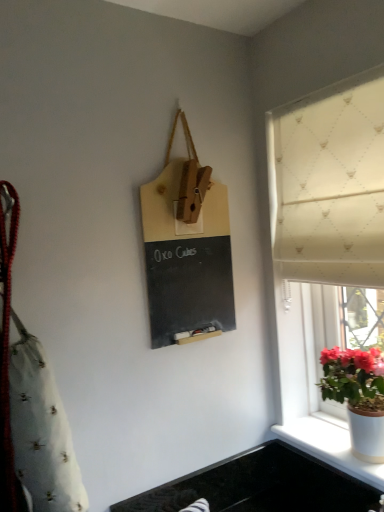
The image size is (384, 512). What are the coordinates of `white glossy pot at window` in the screenshot? It's located at (358, 396).

Measure the distance between point (184, 225) and camera.

The distance of point (184, 225) from camera is 1.20 meters.

The height and width of the screenshot is (512, 384). In order to click on white textured fabric at right in this screenshot , I will do `click(331, 254)`.

Is white textured fabric at right with white glossy pot at window?

No, white textured fabric at right is not with white glossy pot at window.

Which is further, (369, 143) or (364, 383)?

Positioned behind is point (364, 383).

Do you think white textured fabric at right is within white glossy pot at window, or outside of it?

white textured fabric at right lies outside white glossy pot at window.

From the image's perspective, relative to white ceramic pot at lower right, is white glossy pot at window above or below?

white glossy pot at window is situated higher than white ceramic pot at lower right in the image.

From a real-world perspective, is white glossy pot at window over white ceramic pot at lower right?

Yes.

Is white glossy pot at window inside the boundaries of white ceramic pot at lower right, or outside?

The correct answer is: outside.

Locate an element on the screen. window sill below the white glossy pot at window (from the image's perspective) is located at coordinates (329, 445).

Choose the correct answer: Is white ceramic pot at lower right inside black granite sink at lower center or outside it?

white ceramic pot at lower right is located beyond the bounds of black granite sink at lower center.

Is white ceramic pot at lower right next to black granite sink at lower center?

No, white ceramic pot at lower right is not next to black granite sink at lower center.

From a real-world perspective, is white ceramic pot at lower right beneath black granite sink at lower center?

Incorrect, from a real-world perspective, white ceramic pot at lower right is higher than black granite sink at lower center.

Based on the photo, between white ceramic pot at lower right and black granite sink at lower center, which one has smaller size?

white ceramic pot at lower right.

From a real-world perspective, is white glossy pot at window above or below white textured fabric at right?

white glossy pot at window is below white textured fabric at right.

Is white glossy pot at window oriented towards white textured fabric at right?

Yes, white glossy pot at window is facing white textured fabric at right.

From the image's perspective, is white glossy pot at window under white textured fabric at right?

Yes, from the image's perspective, white glossy pot at window is below white textured fabric at right.

Considering the relative sizes of white glossy pot at window and white textured fabric at right in the image provided, is white glossy pot at window thinner than white textured fabric at right?

In fact, white glossy pot at window might be wider than white textured fabric at right.

Considering the positions of objects black granite sink at lower center and white glossy pot at window in the image provided, who is more to the right, black granite sink at lower center or white glossy pot at window?

white glossy pot at window is more to the right.

From a real-world perspective, does black granite sink at lower center sit lower than white glossy pot at window?

Yes, from a real-world perspective, black granite sink at lower center is beneath white glossy pot at window.

Could you tell me if black granite sink at lower center is facing white glossy pot at window?

No, black granite sink at lower center does not turn towards white glossy pot at window.

Is black granite sink at lower center further to the viewer compared to white glossy pot at window?

Yes, black granite sink at lower center is behind white glossy pot at window.

Is white ceramic pot at lower right next to white glossy pot at window?

No, white ceramic pot at lower right is not next to white glossy pot at window.

Is white ceramic pot at lower right spatially inside white glossy pot at window, or outside of it?

white ceramic pot at lower right is spatially situated outside white glossy pot at window.

In the image, is white ceramic pot at lower right positioned in front of or behind white glossy pot at window?

white ceramic pot at lower right is behind white glossy pot at window.

From the picture: Between white ceramic pot at lower right and white glossy pot at window, which one has smaller width?

Thinner between the two is white ceramic pot at lower right.

From a real-world perspective, which object rests below the other?

white ceramic pot at lower right is physically lower.

Is white ceramic pot at lower right outside of white textured fabric at right?

Yes, white ceramic pot at lower right is not within white textured fabric at right.

Is white ceramic pot at lower right wider than white textured fabric at right?

No.

From the image's perspective, which object appears higher, white ceramic pot at lower right or white textured fabric at right?

white textured fabric at right.

This screenshot has height=512, width=384. I want to click on window above the white glossy pot at window (from a real-world perspective), so click(x=331, y=254).

Where is `houseplant lying on the right of white ceramic pot at lower right`? This screenshot has height=512, width=384. houseplant lying on the right of white ceramic pot at lower right is located at coordinates (358, 396).

Which object lies nearer to the anchor point black granite sink at lower center, matte wood chalkboard at center or white ceramic pot at lower right?

white ceramic pot at lower right is closer to black granite sink at lower center.

When comparing their distances from matte wood chalkboard at center, does white glossy pot at window or white textured fabric at right seem closer?

white textured fabric at right is positioned closer to the anchor matte wood chalkboard at center.

From the image, which object appears to be farther from matte wood chalkboard at center, black granite sink at lower center or white textured fabric at right?

Based on the image, black granite sink at lower center appears to be further to matte wood chalkboard at center.

Considering their positions, is matte wood chalkboard at center positioned closer to white textured fabric at right than white glossy pot at window?

white glossy pot at window lies closer to white textured fabric at right than the other object.

Based on their spatial positions, is white ceramic pot at lower right or white glossy pot at window further from matte wood chalkboard at center?

white ceramic pot at lower right is further to matte wood chalkboard at center.

Considering their positions, is matte wood chalkboard at center positioned further to black granite sink at lower center than white textured fabric at right?

matte wood chalkboard at center is further to black granite sink at lower center.

When comparing their distances from white glossy pot at window, does black granite sink at lower center or matte wood chalkboard at center seem closer?

Among the two, black granite sink at lower center is located nearer to white glossy pot at window.

Which object lies further to the anchor point matte wood chalkboard at center, white textured fabric at right or black granite sink at lower center?

black granite sink at lower center lies further to matte wood chalkboard at center than the other object.

The image size is (384, 512). Identify the location of houseplant between white textured fabric at right and white ceramic pot at lower right from top to bottom. (358, 396).

Where is `window located between matte wood chalkboard at center and white glossy pot at window in the left-right direction`? The width and height of the screenshot is (384, 512). window located between matte wood chalkboard at center and white glossy pot at window in the left-right direction is located at coordinates (331, 254).

At what (x,y) coordinates should I click in order to perform the action: click on houseplant between white textured fabric at right and black granite sink at lower center from top to bottom. Please return your answer as a coordinate pair (x, y). This screenshot has height=512, width=384. Looking at the image, I should click on (358, 396).

I want to click on houseplant between matte wood chalkboard at center and black granite sink at lower center in the up-down direction, so click(358, 396).